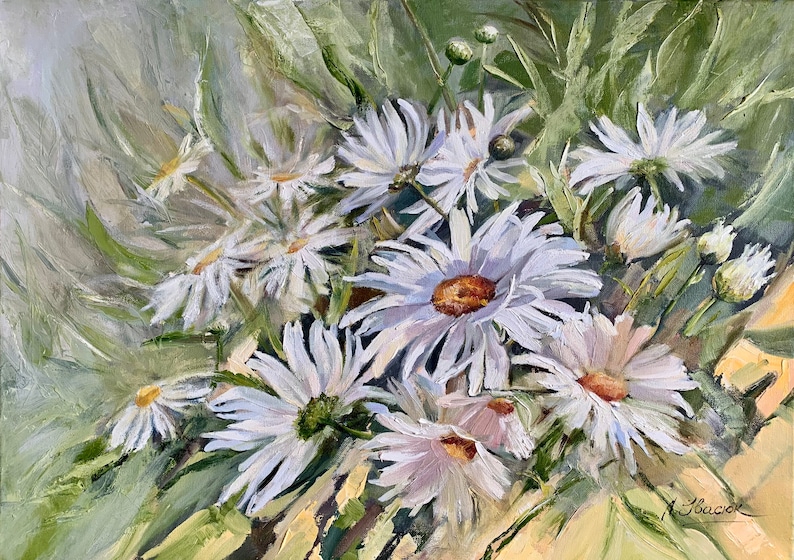
Where is `bottom left corner of painting`? bottom left corner of painting is located at coordinates (1, 557).